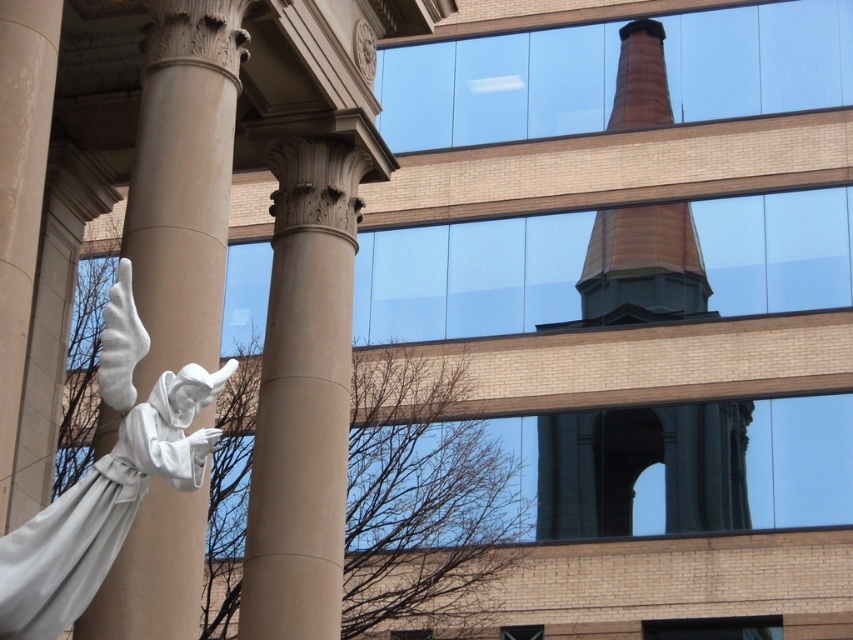
You are an architect analyzing the spatial relationship between the smooth beige column at center and the brown brick bell tower at upper center. From your vantage point, which object appears closer to you?

The smooth beige column at center appears closer because it is positioned in front of the brown brick bell tower at upper center.

You are an architect analyzing the building. Which object, the smooth beige column at center or the brown brick bell tower at upper center, is taller?

The brown brick bell tower at upper center is taller than the smooth beige column at center.